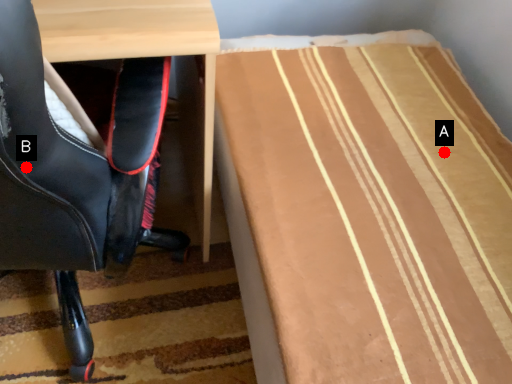
Question: Two points are circled on the image, labeled by A and B beside each circle. Which point is further to the camera?

Choices:
 (A) A is further
 (B) B is further

Answer: (A)